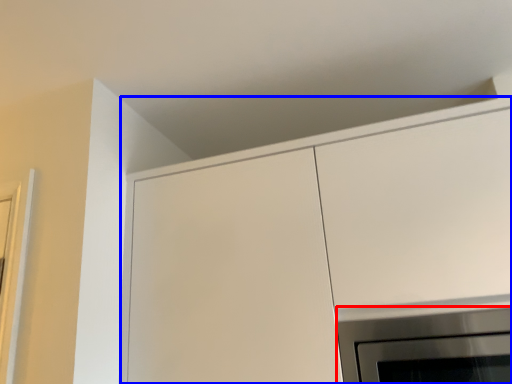
Question: Which object appears farthest to the camera in this image, appliance (highlighted by a red box) or cabinetry (highlighted by a blue box)?

Choices:
 (A) appliance
 (B) cabinetry

Answer: (A)